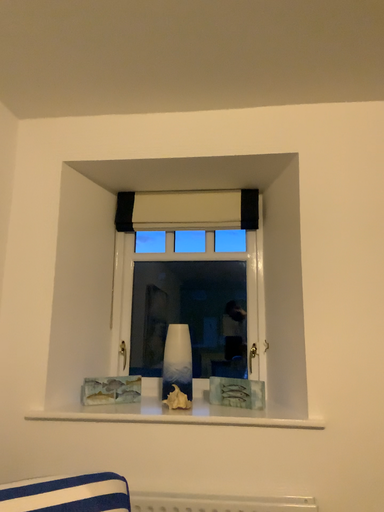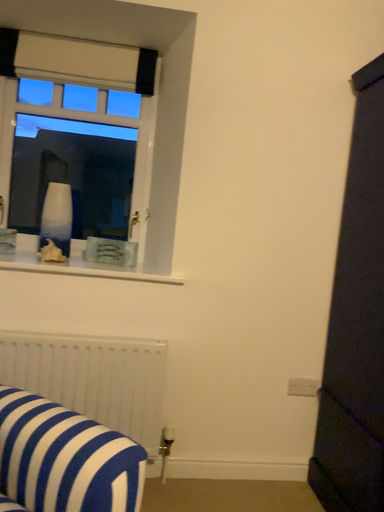
Question: Which way did the camera rotate in the video?

Choices:
 (A) rotated downward
 (B) rotated upward

Answer: (A)